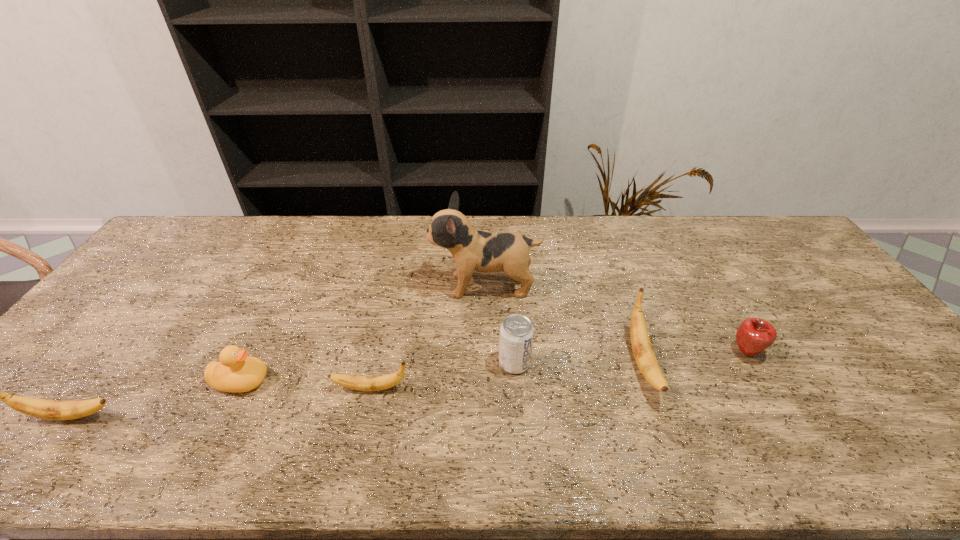
Please point a spot on the right to add another banana. Please provide its 2D coordinates. Your answer should be formatted as a tuple, i.e. [(x, y)], where the tuple contains the x and y coordinates of a point satisfying the conditions above.

[(887, 341)]